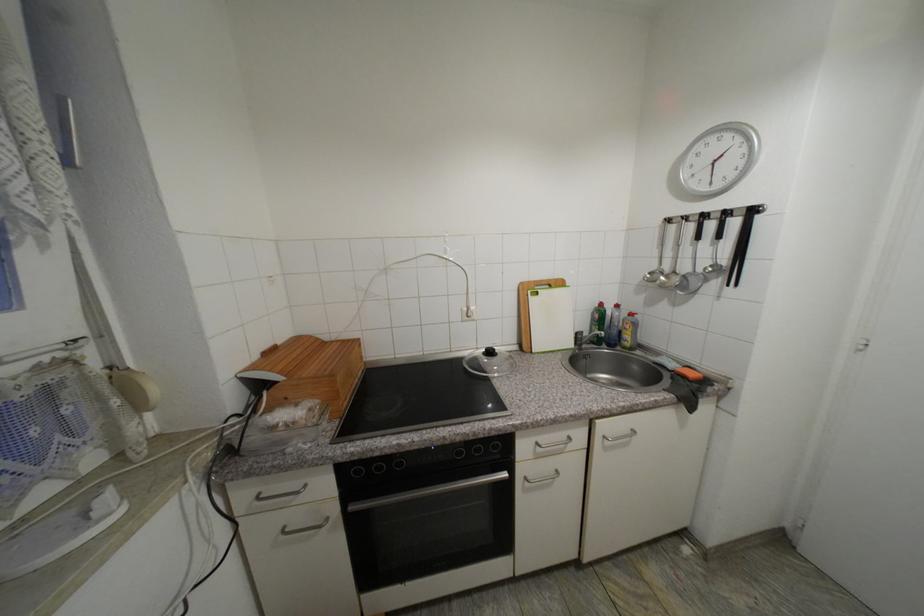
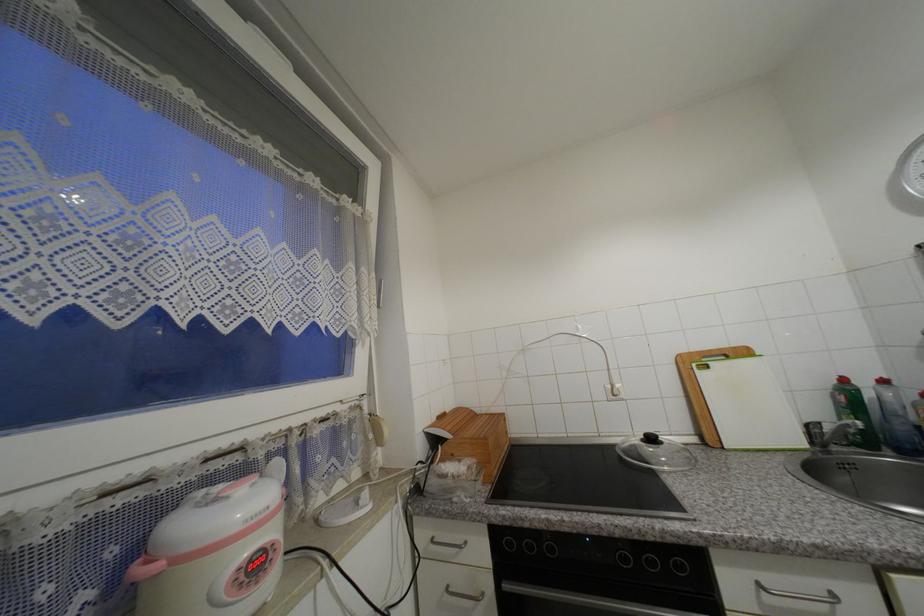
The point at (535,293) is marked in the first image. Where is the corresponding point in the second image?

(699, 367)